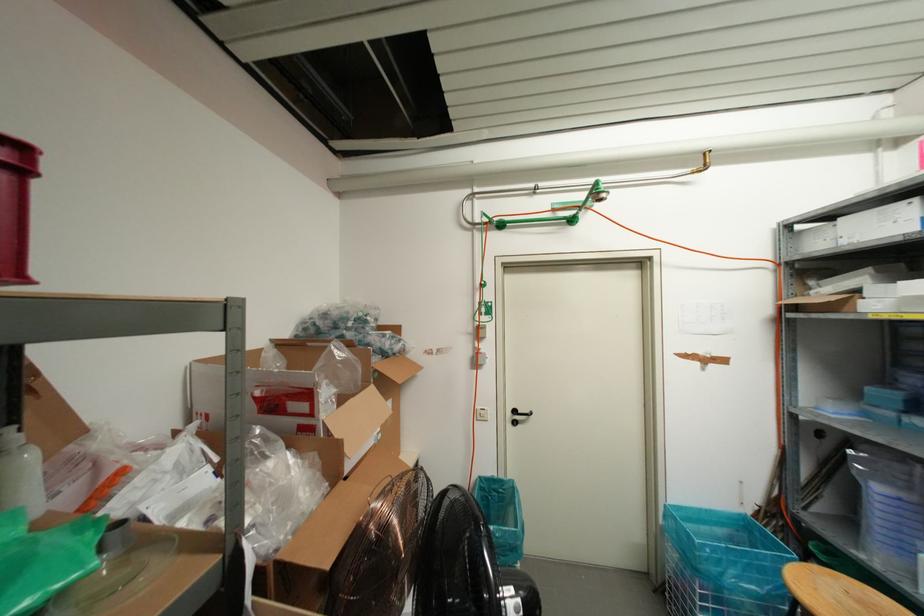
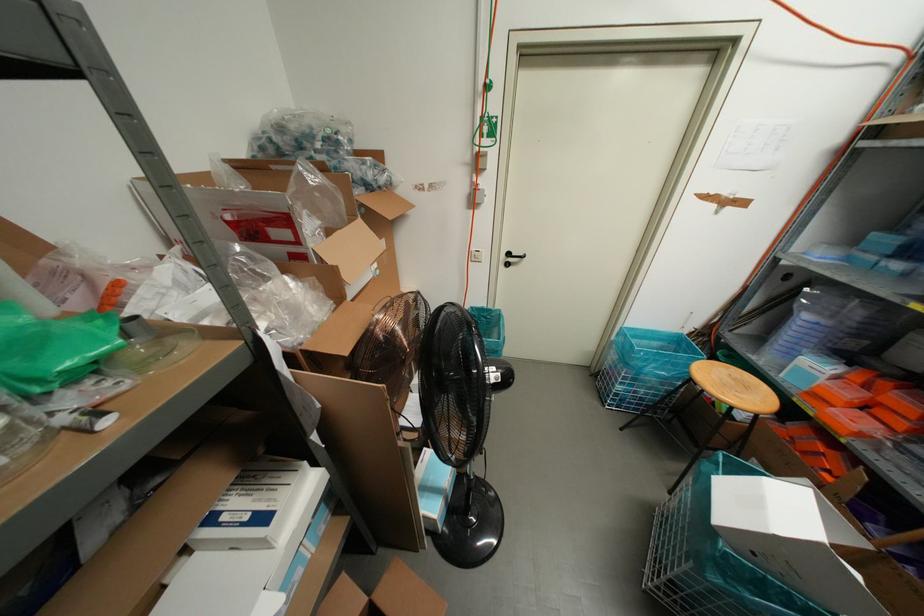
The point at (514, 422) is marked in the first image. Where is the corresponding point in the second image?

(506, 264)